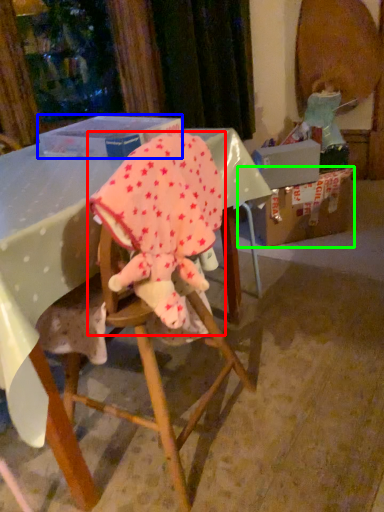
Question: Based on their relative distances, which object is nearer to baby elephant (highlighted by a red box)? Choose from box (highlighted by a blue box) and cardboard box (highlighted by a green box).

Choices:
 (A) box
 (B) cardboard box

Answer: (A)